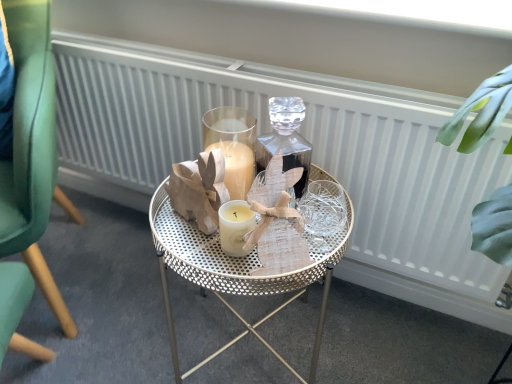
Identify the location of free region on the left part of metallic gold table at center. (131, 312).